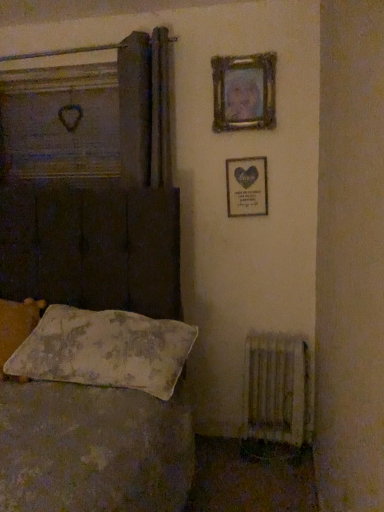
Question: Would you say wooden frame at upper right, positioned as the second picture frame in bottom-to-top order, is to the left or to the right of white textured radiator at lower right in the picture?

Choices:
 (A) right
 (B) left

Answer: (B)

Question: Considering their positions, is wooden frame at upper right, arranged as the first picture frame when viewed from the top, located in front of or behind white textured radiator at lower right?

Choices:
 (A) front
 (B) behind

Answer: (B)

Question: Estimate the real-world distances between objects in this image. Which object is closer to the wooden frame at upper right, positioned as the second picture frame in bottom-to-top order?

Choices:
 (A) floral fabric pillow at lower left, acting as the 1th pillow starting from the right
 (B) fluffy white pillow at lower left, which ranks as the second pillow in right-to-left order
 (C) white textured radiator at lower right
 (D) wooden frame with heart at upper right, acting as the first picture frame starting from the bottom

Answer: (D)

Question: Which of these objects is positioned farthest from the white textured radiator at lower right?

Choices:
 (A) wooden frame with heart at upper right, positioned as the second picture frame in top-to-bottom order
 (B) wooden frame at upper right, positioned as the second picture frame in bottom-to-top order
 (C) fluffy white pillow at lower left, which ranks as the second pillow in right-to-left order
 (D) floral fabric pillow at lower left, which is the 2th pillow from left to right

Answer: (B)